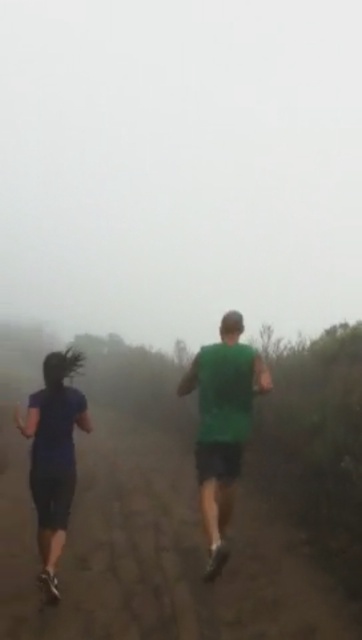
Question: Among these objects, which one is farthest from the camera?

Choices:
 (A) green matte tank top at center
 (B) dark blue fabric at left

Answer: (A)

Question: Is the position of green matte tank top at center less distant than that of dark blue fabric at left?

Choices:
 (A) no
 (B) yes

Answer: (A)

Question: Can you confirm if green matte tank top at center is thinner than dark blue fabric at left?

Choices:
 (A) yes
 (B) no

Answer: (B)

Question: Does green matte tank top at center have a lesser width compared to dark blue fabric at left?

Choices:
 (A) no
 (B) yes

Answer: (A)

Question: Which of the following is the farthest from the observer?

Choices:
 (A) green matte tank top at center
 (B) dark blue fabric at left

Answer: (A)